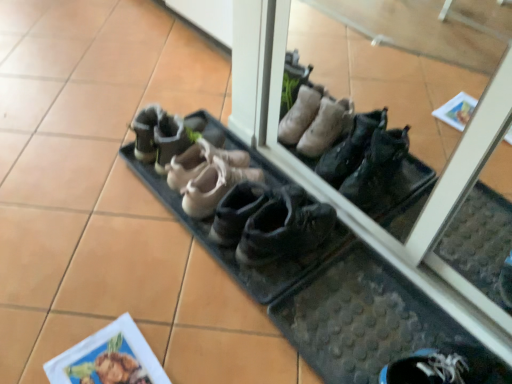
Question: Is leather shoes at center, which is counted as the second footwear, starting from the right, situated inside brown suede shoes at center, acting as the second footwear starting from the left, or outside?

Choices:
 (A) outside
 (B) inside

Answer: (A)

Question: In terms of width, does leather shoes at center, the 3th footwear viewed from the left, look wider or thinner when compared to brown suede shoes at center, acting as the second footwear starting from the left?

Choices:
 (A) thin
 (B) wide

Answer: (A)

Question: Estimate the real-world distances between objects in this image. Which object is farther from the leather/soft suede ballet flats at center, positioned as the 1th footwear in left-to-right order?

Choices:
 (A) matte paper at lower left
 (B) black rubber boot at center, the 4th footwear when ordered from left to right
 (C) brown suede shoes at center, acting as the second footwear starting from the left
 (D) leather shoes at center, the 3th footwear viewed from the left

Answer: (A)

Question: Which is nearer to the leather/soft suede ballet flats at center, positioned as the fourth footwear in right-to-left order?

Choices:
 (A) leather shoes at center, which is counted as the second footwear, starting from the right
 (B) black rubber boot at center, the first footwear from the right
 (C) matte paper at lower left
 (D) brown suede shoes at center, acting as the second footwear starting from the left

Answer: (A)